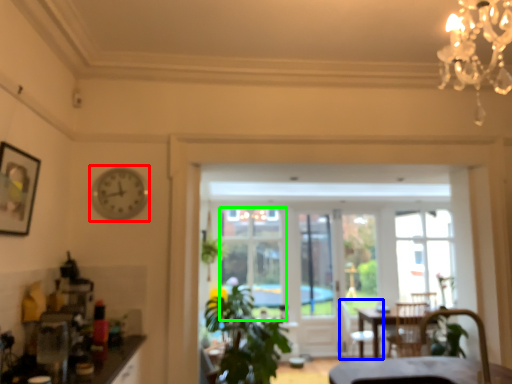
Question: Which is nearer to the clock (highlighted by a red box)? armchair (highlighted by a blue box) or window (highlighted by a green box).

Choices:
 (A) armchair
 (B) window

Answer: (B)